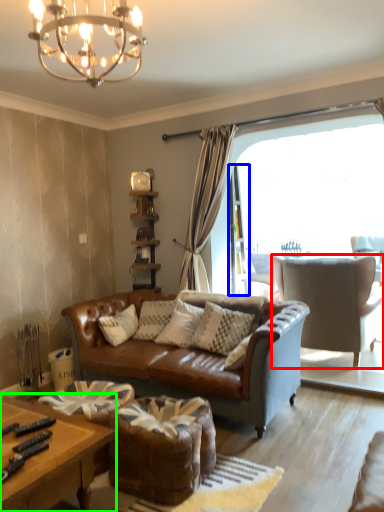
Question: Estimate the real-world distances between objects in this image. Which object is farther from chair (highlighted by a red box), screen door (highlighted by a blue box) or coffee table (highlighted by a green box)?

Choices:
 (A) screen door
 (B) coffee table

Answer: (B)